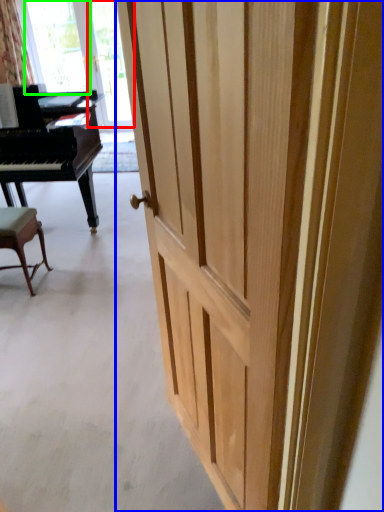
Question: Which object is positioned farthest from glass door (highlighted by a red box)? Select from door (highlighted by a blue box) and window screen (highlighted by a green box).

Choices:
 (A) door
 (B) window screen

Answer: (A)